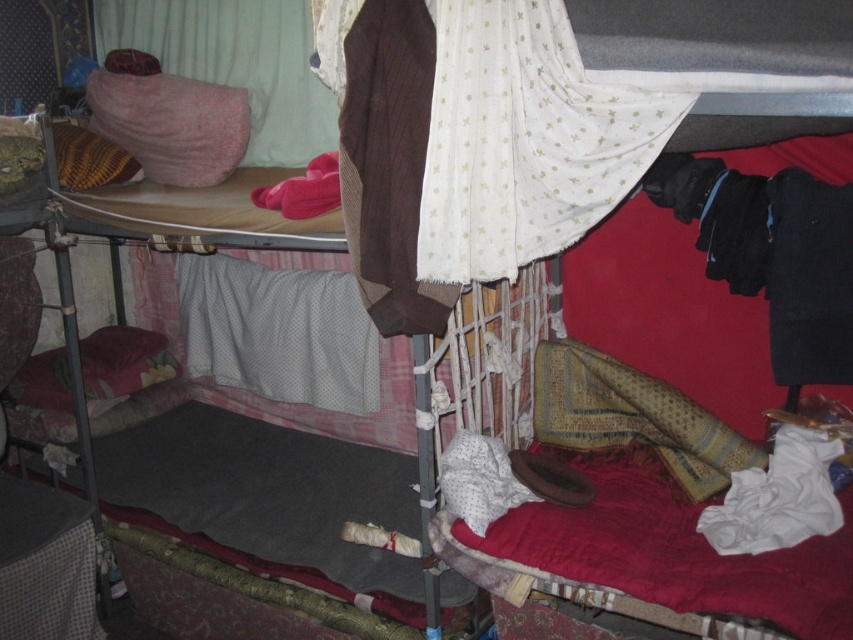
Question: Does velvety pink pillow at upper left appear on the right side of pink soft pillow at upper left?

Choices:
 (A) no
 (B) yes

Answer: (B)

Question: Which object is closer to the camera taking this photo?

Choices:
 (A) pink soft pillow at upper left
 (B) velvety pink pillow at upper left

Answer: (A)

Question: Which point is closer to the camera?

Choices:
 (A) (216, 26)
 (B) (161, 120)

Answer: (B)

Question: Is velvety pink pillow at upper left further to camera compared to pink soft pillow at upper left?

Choices:
 (A) no
 (B) yes

Answer: (B)

Question: Can you confirm if velvety pink pillow at upper left is positioned above pink soft pillow at upper left?

Choices:
 (A) no
 (B) yes

Answer: (B)